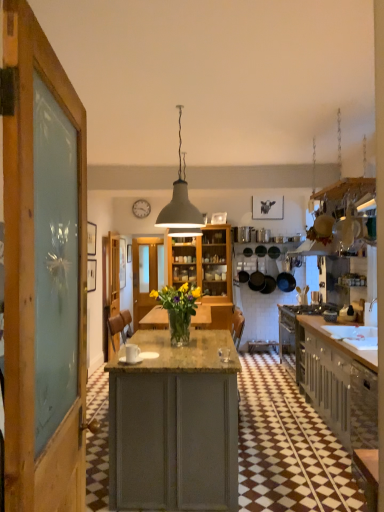
Question: In terms of height, does wooden door at center look taller or shorter compared to translucent glass vase at center?

Choices:
 (A) short
 (B) tall

Answer: (B)

Question: Is wooden door at center inside or outside of translucent glass vase at center?

Choices:
 (A) outside
 (B) inside

Answer: (A)

Question: Estimate the real-world distances between objects in this image. Which object is closer to the wooden door at center?

Choices:
 (A) translucent glass vase at center
 (B) white matte pendant light at center
 (C) transparent glass door at center
 (D) matte gray cabinets at right

Answer: (C)

Question: Which is farther from the transparent glass door at center?

Choices:
 (A) white matte pendant light at center
 (B) translucent glass vase at center
 (C) matte gray cabinets at right
 (D) wooden door at center

Answer: (C)